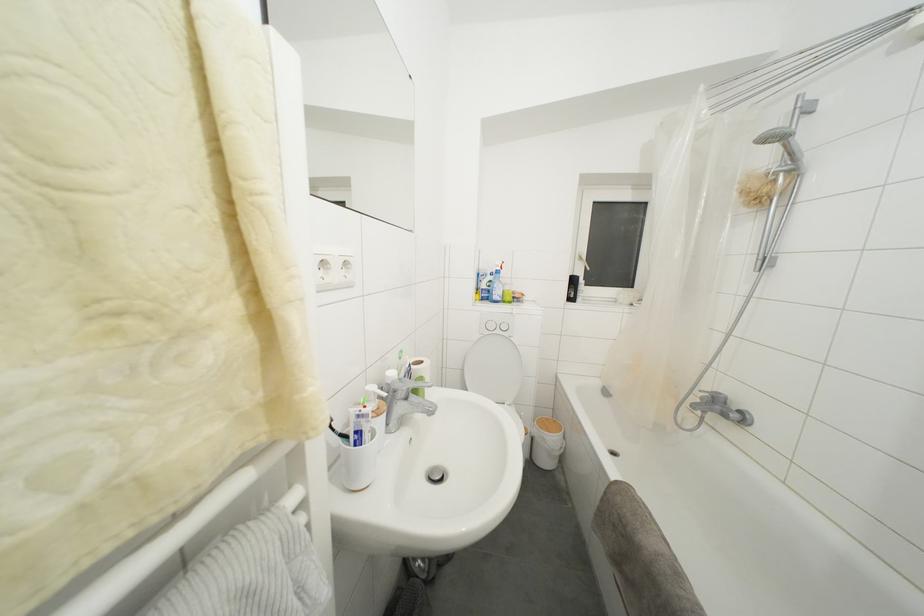
Where is `black bottle`? Image resolution: width=924 pixels, height=616 pixels. black bottle is located at coordinates (572, 288).